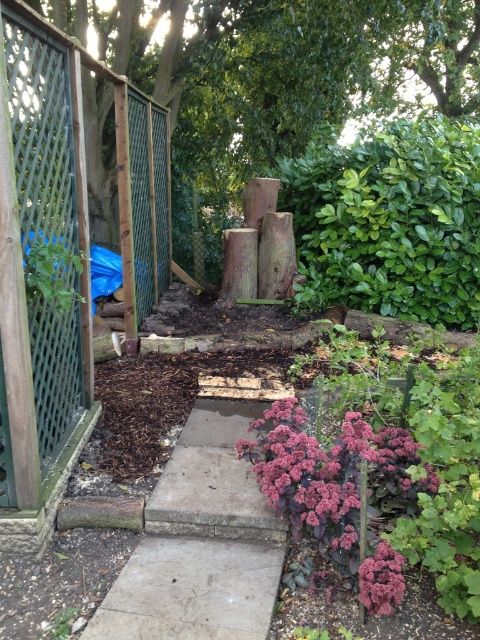
Question: In this image, where is green lattice fence at left located relative to purple matte flower at lower right?

Choices:
 (A) above
 (B) below

Answer: (A)

Question: Does smooth concrete path at center appear on the left side of purple matte flower at lower center?

Choices:
 (A) yes
 (B) no

Answer: (A)

Question: Among these objects, which one is farthest from the camera?

Choices:
 (A) purple matte flower at lower right
 (B) smooth concrete path at center
 (C) green lattice fence at left

Answer: (C)

Question: Estimate the real-world distances between objects in this image. Which object is farther from the smooth concrete path at center?

Choices:
 (A) green lattice fence at left
 (B) purple matte flower at lower center
 (C) purple matte flower at lower right

Answer: (A)

Question: Considering the real-world distances, which object is farthest from the smooth concrete path at center?

Choices:
 (A) purple matte flower at lower center
 (B) purple matte flower at lower right

Answer: (A)

Question: Where is green lattice fence at left located in relation to smooth concrete path at center in the image?

Choices:
 (A) left
 (B) right

Answer: (A)